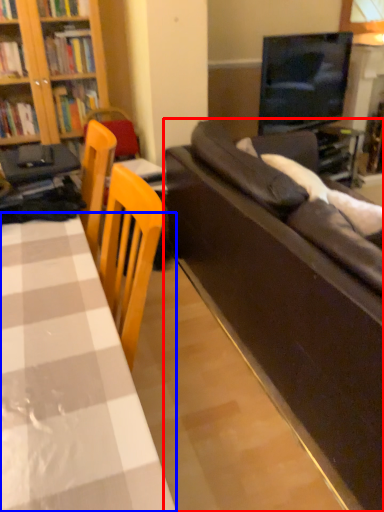
Question: Which object is closer to the camera taking this photo, studio couch (highlighted by a red box) or table (highlighted by a blue box)?

Choices:
 (A) studio couch
 (B) table

Answer: (B)